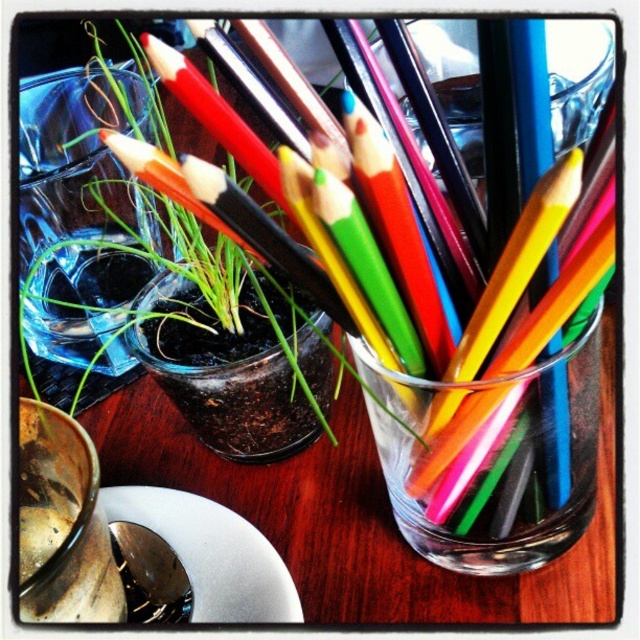
Question: Is transparent glass vase at upper left to the left of white glossy plate at lower left from the viewer's perspective?

Choices:
 (A) no
 (B) yes

Answer: (B)

Question: Is transparent glass vase at upper left to the right of white glossy plate at lower left from the viewer's perspective?

Choices:
 (A) yes
 (B) no

Answer: (B)

Question: Which point is farther from the camera taking this photo?

Choices:
 (A) tap(81, 253)
 (B) tap(216, 513)

Answer: (A)

Question: Is transparent glass vase at upper left thinner than white glossy plate at lower left?

Choices:
 (A) no
 (B) yes

Answer: (B)

Question: Among these points, which one is nearest to the camera?

Choices:
 (A) (216, 595)
 (B) (138, 372)

Answer: (A)